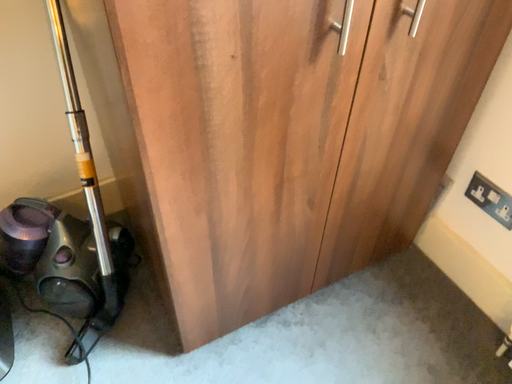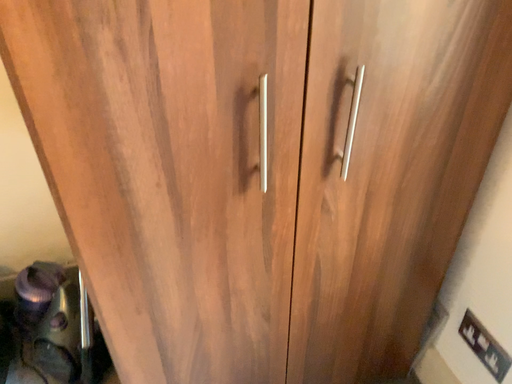
Question: How did the camera likely rotate when shooting the video?

Choices:
 (A) rotated right
 (B) rotated left

Answer: (B)